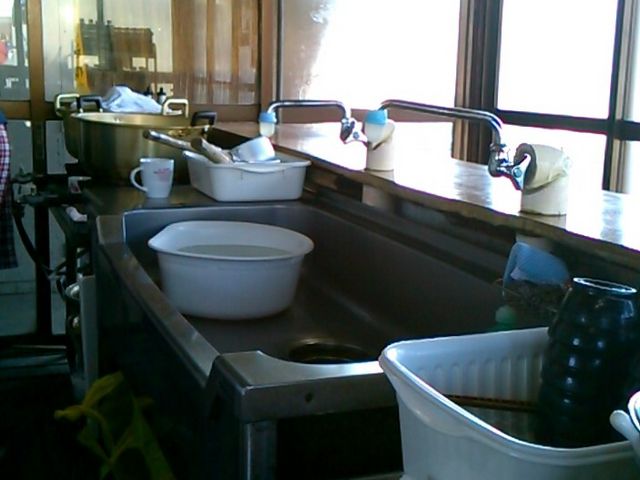
Image resolution: width=640 pixels, height=480 pixels. In order to click on black handle on large steel bowl in this screenshot , I will do click(202, 115).